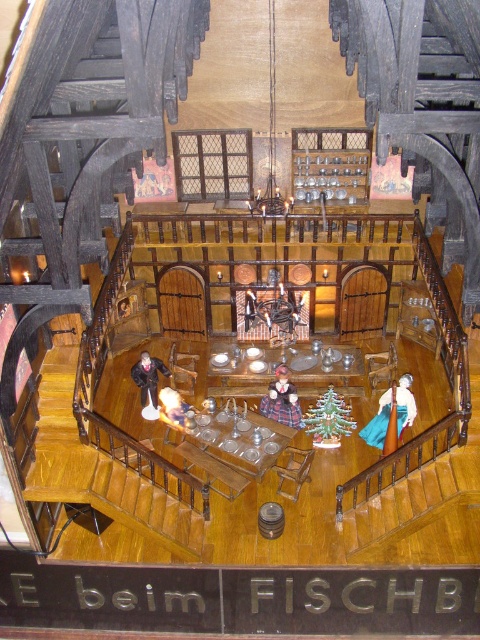
Between smooth fabric doll at center and black velvet coat at center, which one has more height?

With more height is smooth fabric doll at center.

Is point (279, 404) farther from camera compared to point (141, 372)?

No, it is not.

Who is more forward, (296, 394) or (145, 368)?

Point (296, 394)

The height and width of the screenshot is (640, 480). In order to click on smooth fabric doll at center in this screenshot , I will do `click(282, 401)`.

Does wooden stairs at center have a smaller size compared to blue fabric dress at lower right?

No.

Who is more distant from viewer, (59, 400) or (396, 400)?

Point (396, 400)

Where is `wooden stairs at center`? This screenshot has height=640, width=480. wooden stairs at center is located at coordinates (100, 472).

I want to click on wooden stairs at center, so click(100, 472).

Which is more to the left, blue fabric dress at lower right or black velvet coat at center?

From the viewer's perspective, black velvet coat at center appears more on the left side.

What do you see at coordinates (391, 416) in the screenshot?
I see `blue fabric dress at lower right` at bounding box center [391, 416].

Find the location of `blue fabric dress at lower right`. blue fabric dress at lower right is located at coordinates (391, 416).